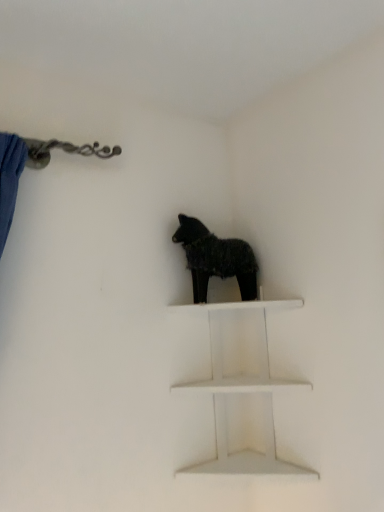
Find the location of a particular element. black furry dog at center is located at coordinates (215, 259).

The image size is (384, 512). What do you see at coordinates (215, 259) in the screenshot?
I see `black furry dog at center` at bounding box center [215, 259].

What do you see at coordinates (241, 392) in the screenshot?
I see `white matte shelf at center` at bounding box center [241, 392].

Identify the location of white matte shelf at center. The height and width of the screenshot is (512, 384). (241, 392).

Locate an element on the screen. black furry dog at center is located at coordinates (215, 259).

In the image, is white matte shelf at center on the left side or the right side of black furry dog at center?

Based on their positions, white matte shelf at center is located to the right of black furry dog at center.

Which is in front, white matte shelf at center or black furry dog at center?

white matte shelf at center.

Which is farther, (x=274, y=386) or (x=213, y=250)?

Point (x=213, y=250)

From the image's perspective, would you say white matte shelf at center is positioned over black furry dog at center?

Actually, white matte shelf at center appears below black furry dog at center in the image.

From a real-world perspective, is white matte shelf at center above or below black furry dog at center?

Clearly, from a real-world perspective, white matte shelf at center is below black furry dog at center.

Which object is thinner, white matte shelf at center or black furry dog at center?

black furry dog at center.

Does white matte shelf at center have a lesser height compared to black furry dog at center?

Incorrect, the height of white matte shelf at center does not fall short of that of black furry dog at center.

In terms of size, does white matte shelf at center appear bigger or smaller than black furry dog at center?

Considering their sizes, white matte shelf at center takes up more space than black furry dog at center.

Would you say white matte shelf at center is inside or outside black furry dog at center?

white matte shelf at center cannot be found inside black furry dog at center.

Does white matte shelf at center touch black furry dog at center?

No, white matte shelf at center is not in contact with black furry dog at center.

Could you tell me if white matte shelf at center is facing black furry dog at center?

No, white matte shelf at center is not aimed at black furry dog at center.

How many degrees apart are the facing directions of white matte shelf at center and black furry dog at center?

There is a 30.9-degree angle between the facing directions of white matte shelf at center and black furry dog at center.

How distant is white matte shelf at center from black furry dog at center?

white matte shelf at center and black furry dog at center are 8.51 inches apart.

Image resolution: width=384 pixels, height=512 pixels. I want to click on dog above the white matte shelf at center (from the image's perspective), so [215, 259].

Can you confirm if black furry dog at center is positioned to the right of white matte shelf at center?

No.

Which object is further away from the camera taking this photo, black furry dog at center or white matte shelf at center?

black furry dog at center is more distant.

Which point is more distant from viewer, (x=244, y=245) or (x=246, y=463)?

The point (x=244, y=245) is farther from the camera.

From the image's perspective, is black furry dog at center positioned above or below white matte shelf at center?

Based on their image positions, black furry dog at center is located above white matte shelf at center.

From a real-world perspective, which object rests below the other?

In real-world perspective, white matte shelf at center is lower.

Is black furry dog at center wider or thinner than white matte shelf at center?

black furry dog at center is thinner than white matte shelf at center.

Does black furry dog at center have a lesser height compared to white matte shelf at center?

Indeed, black furry dog at center has a lesser height compared to white matte shelf at center.

Considering the relative sizes of black furry dog at center and white matte shelf at center in the image provided, is black furry dog at center bigger than white matte shelf at center?

No.

Is white matte shelf at center located within black furry dog at center?

No.

Would you say black furry dog at center is a long distance from white matte shelf at center?

Actually, black furry dog at center and white matte shelf at center are a little close together.

Is black furry dog at center oriented away from white matte shelf at center?

That's not correct — black furry dog at center is not looking away from white matte shelf at center.

How different are the orientations of black furry dog at center and white matte shelf at center in degrees?

They differ by 30.9 degrees in their facing directions.

Where is `shelf below the black furry dog at center (from the image's perspective)`? shelf below the black furry dog at center (from the image's perspective) is located at coordinates (241, 392).

At what (x,y) coordinates should I click in order to perform the action: click on dog on the left of white matte shelf at center. Please return your answer as a coordinate pair (x, y). Looking at the image, I should click on (215, 259).

The width and height of the screenshot is (384, 512). I want to click on dog behind the white matte shelf at center, so click(x=215, y=259).